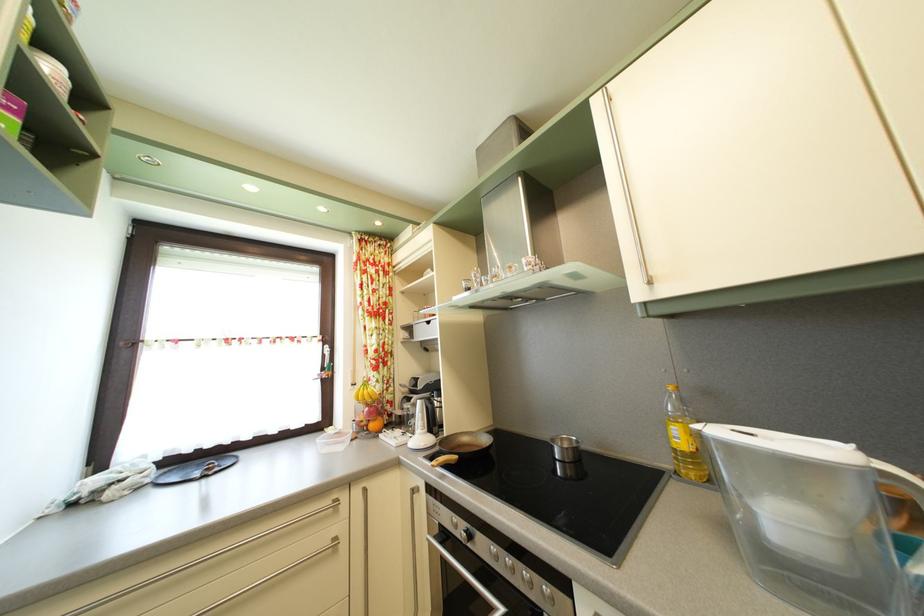
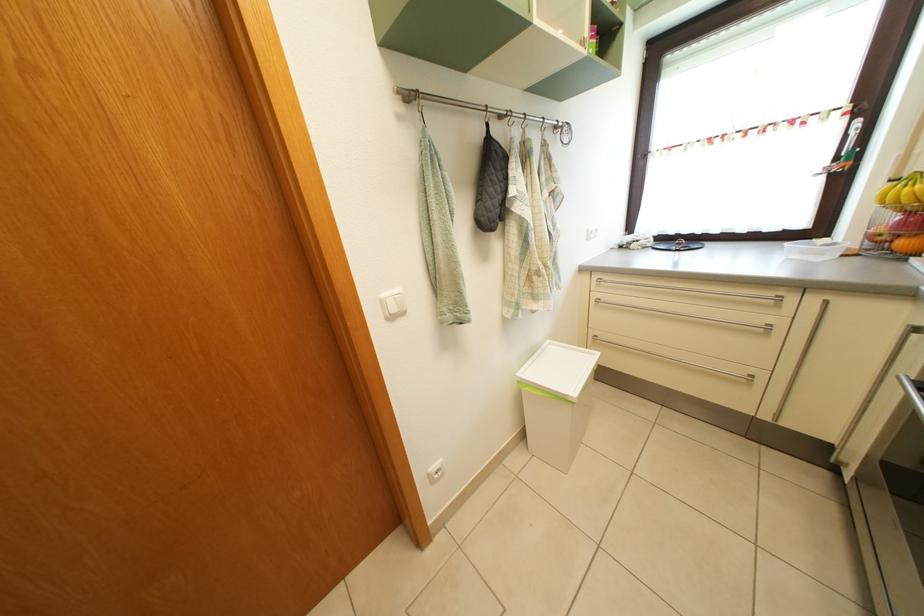
Find the pixel in the second image that matches pixel 334 509 in the first image.

(776, 302)